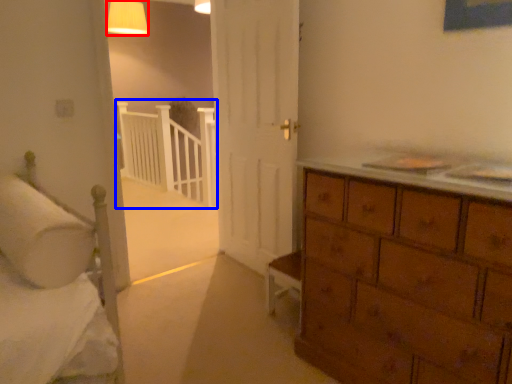
Question: Which object appears closest to the camera in this image, lighting (highlighted by a red box) or balustrade (highlighted by a blue box)?

Choices:
 (A) lighting
 (B) balustrade

Answer: (A)